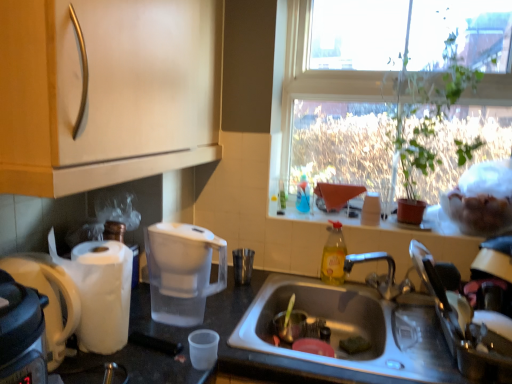
This screenshot has width=512, height=384. What do you see at coordinates (243, 265) in the screenshot?
I see `brushed metal cup at sink, the second coffee cup when ordered from front to back` at bounding box center [243, 265].

Locate an element on the screen. The image size is (512, 384). yellow translucent bottle at sink, which is counted as the 2th bottle, starting from the top is located at coordinates (334, 255).

The width and height of the screenshot is (512, 384). Describe the element at coordinates (334, 255) in the screenshot. I see `yellow translucent bottle at sink, which is counted as the 2th bottle, starting from the top` at that location.

Find the location of a particular element. This screenshot has height=384, width=512. white plastic coffee maker at left, marked as the 1th coffee maker in a front-to-back arrangement is located at coordinates (48, 298).

You are a GUI agent. You are given a task and a screenshot of the screen. Output one action in this format:
    pyautogui.click(x=<x>, y=<y>)
    Task: Click on the transparent plastic water filter at center, the first coffee maker when ordered from back to front
    This screenshot has height=384, width=512.
    Given the screenshot: What is the action you would take?
    pyautogui.click(x=182, y=271)

Which object is positioned more to the right, green leafy plant at upper right or stainless steel sink at lower center?

green leafy plant at upper right.

Is stainless steel sink at lower center a part of green leafy plant at upper right?

No, stainless steel sink at lower center is not surrounded by green leafy plant at upper right.

From a real-world perspective, does green leafy plant at upper right sit lower than stainless steel sink at lower center?

No, from a real-world perspective, green leafy plant at upper right is not under stainless steel sink at lower center.

Based on their sizes in the image, would you say translucent plastic spray bottle at upper right, the first bottle from the top, is bigger or smaller than white plastic coffee maker at left, marked as the 1th coffee maker in a front-to-back arrangement?

translucent plastic spray bottle at upper right, the first bottle from the top, is smaller than white plastic coffee maker at left, marked as the 1th coffee maker in a front-to-back arrangement.

Can you confirm if translucent plastic spray bottle at upper right, positioned as the 2th bottle in bottom-to-top order, is thinner than white plastic coffee maker at left, marked as the 1th coffee maker in a front-to-back arrangement?

Correct, the width of translucent plastic spray bottle at upper right, positioned as the 2th bottle in bottom-to-top order, is less than that of white plastic coffee maker at left, marked as the 1th coffee maker in a front-to-back arrangement.

From the image's perspective, does translucent plastic spray bottle at upper right, the first bottle from the top, appear higher than white plastic coffee maker at left, marked as the 1th coffee maker in a front-to-back arrangement?

Yes, from the image's perspective, translucent plastic spray bottle at upper right, the first bottle from the top, is over white plastic coffee maker at left, marked as the 1th coffee maker in a front-to-back arrangement.

Is white plastic coffee maker at left, marked as the 1th coffee maker in a front-to-back arrangement, completely or partially inside translucent plastic spray bottle at upper right, marked as the 2th bottle in a front-to-back arrangement?

That's incorrect, white plastic coffee maker at left, marked as the 1th coffee maker in a front-to-back arrangement, is not inside translucent plastic spray bottle at upper right, marked as the 2th bottle in a front-to-back arrangement.

From the image's perspective, which one is positioned lower, brushed metal cup at sink, which is the 2th coffee cup from bottom to top, or yellow translucent bottle at sink, positioned as the first bottle in right-to-left order?

From the image's view, brushed metal cup at sink, which is the 2th coffee cup from bottom to top, is below.

Is brushed metal cup at sink, the 1th coffee cup in the back-to-front sequence, with yellow translucent bottle at sink, positioned as the first bottle in right-to-left order?

There is a gap between brushed metal cup at sink, the 1th coffee cup in the back-to-front sequence, and yellow translucent bottle at sink, positioned as the first bottle in right-to-left order.

Does brushed metal cup at sink, marked as the first coffee cup in a right-to-left arrangement, contain yellow translucent bottle at sink, which is counted as the 2th bottle, starting from the top?

That's incorrect, yellow translucent bottle at sink, which is counted as the 2th bottle, starting from the top, is not inside brushed metal cup at sink, marked as the first coffee cup in a right-to-left arrangement.

Can you tell me how much brushed metal cup at sink, which is the 2th coffee cup from bottom to top, and yellow translucent bottle at sink, which is the first bottle in bottom-to-top order, differ in facing direction?

19.8 degrees.

From the image's perspective, which one is positioned lower, yellow translucent bottle at sink, which ranks as the first bottle in front-to-back order, or transparent plastic cup at lower center, the 1th coffee cup when ordered from left to right?

transparent plastic cup at lower center, the 1th coffee cup when ordered from left to right, from the image's perspective.

Which is in front, yellow translucent bottle at sink, arranged as the second bottle when viewed from the back, or transparent plastic cup at lower center, which is the 1th coffee cup from bottom to top?

transparent plastic cup at lower center, which is the 1th coffee cup from bottom to top.

Is point (331, 226) positioned before point (198, 335)?

That is False.

In the scene shown: Are white plastic coffee maker at left, which ranks as the 2th coffee maker in right-to-left order, and transparent glass window at upper right located far from each other?

That's right, there is a large distance between white plastic coffee maker at left, which ranks as the 2th coffee maker in right-to-left order, and transparent glass window at upper right.

Considering the relative sizes of white plastic coffee maker at left, marked as the 1th coffee maker in a front-to-back arrangement, and transparent glass window at upper right in the image provided, is white plastic coffee maker at left, marked as the 1th coffee maker in a front-to-back arrangement, thinner than transparent glass window at upper right?

In fact, white plastic coffee maker at left, marked as the 1th coffee maker in a front-to-back arrangement, might be wider than transparent glass window at upper right.

From the image's perspective, is white plastic coffee maker at left, which ranks as the 2th coffee maker in right-to-left order, located above or below transparent glass window at upper right?

Clearly, from the image's perspective, white plastic coffee maker at left, which ranks as the 2th coffee maker in right-to-left order, is below transparent glass window at upper right.

Is point (62, 323) closer or farther from the camera than point (293, 42)?

Clearly, point (62, 323) is closer to the camera than point (293, 42).

From the picture: Between translucent plastic spray bottle at upper right, positioned as the 2th bottle in bottom-to-top order, and transparent glass window at upper right, which one is positioned in front?

transparent glass window at upper right is more forward.

How much distance is there between translucent plastic spray bottle at upper right, which appears as the first bottle when viewed from the left, and transparent glass window at upper right?

translucent plastic spray bottle at upper right, which appears as the first bottle when viewed from the left, is 13.41 inches from transparent glass window at upper right.

Is translucent plastic spray bottle at upper right, the first bottle from the top, situated inside transparent glass window at upper right or outside?

translucent plastic spray bottle at upper right, the first bottle from the top, is inside transparent glass window at upper right.

From the picture: Which point is more forward, (x=306, y=199) or (x=306, y=37)?

Point (x=306, y=199)

Is point (446, 84) farther from camera compared to point (250, 256)?

No.

Is green leafy plant at upper right looking in the opposite direction of brushed metal cup at sink, which is the 2th coffee cup from bottom to top?

No, green leafy plant at upper right's orientation is not away from brushed metal cup at sink, which is the 2th coffee cup from bottom to top.

Is green leafy plant at upper right spatially inside brushed metal cup at sink, the 1th coffee cup in the back-to-front sequence, or outside of it?

green leafy plant at upper right is not inside brushed metal cup at sink, the 1th coffee cup in the back-to-front sequence, it's outside.

Who is smaller, green leafy plant at upper right or brushed metal cup at sink, marked as the second coffee cup in a left-to-right arrangement?

Smaller between the two is brushed metal cup at sink, marked as the second coffee cup in a left-to-right arrangement.

The width and height of the screenshot is (512, 384). Find the location of `sink to the left of green leafy plant at upper right`. sink to the left of green leafy plant at upper right is located at coordinates pyautogui.click(x=349, y=334).

The image size is (512, 384). Identify the location of coffee maker that is the 2nd object located in front of the translucent plastic spray bottle at upper right, which appears as the first bottle when viewed from the left. (48, 298).

Considering their positions, is clear glass bottle at upper center positioned further to stainless steel sink at lower center than matte wood cabinet at upper left?

matte wood cabinet at upper left lies further to stainless steel sink at lower center than the other object.

Looking at the image, which one is located closer to clear glass bottle at upper center, transparent plastic water filter at center, marked as the second coffee maker in a front-to-back arrangement, or green leafy plant at upper right?

Among the two, green leafy plant at upper right is located nearer to clear glass bottle at upper center.

When comparing their distances from green leafy plant at upper right, does white plastic coffee maker at left, marked as the 1th coffee maker in a front-to-back arrangement, or yellow translucent bottle at sink, which is the first bottle in bottom-to-top order, seem closer?

The object closer to green leafy plant at upper right is yellow translucent bottle at sink, which is the first bottle in bottom-to-top order.

From the picture: From the image, which object appears to be farther from transparent glass window at upper right, yellow translucent bottle at sink, the 2th bottle in the left-to-right sequence, or white plastic coffee maker at left, the first coffee maker when ordered from left to right?

white plastic coffee maker at left, the first coffee maker when ordered from left to right, is further to transparent glass window at upper right.

Considering their positions, is green leafy plant at upper right positioned closer to brushed metal cup at sink, the second coffee cup when ordered from front to back, than transparent glass window at upper right?

The object closer to brushed metal cup at sink, the second coffee cup when ordered from front to back, is transparent glass window at upper right.

Which object lies nearer to the anchor point matte wood cabinet at upper left, brushed metal cup at sink, the first coffee cup viewed from the top, or transparent plastic water filter at center, the first coffee maker when ordered from back to front?

transparent plastic water filter at center, the first coffee maker when ordered from back to front.

Considering their positions, is stainless steel sink at lower center positioned closer to transparent glass window at upper right than transparent plastic water filter at center, the first coffee maker when ordered from back to front?

stainless steel sink at lower center is closer to transparent glass window at upper right.

Looking at the image, which one is located further to transparent glass window at upper right, transparent plastic cup at lower center, which is the 1th coffee cup from front to back, or matte wood cabinet at upper left?

Based on the image, transparent plastic cup at lower center, which is the 1th coffee cup from front to back, appears to be further to transparent glass window at upper right.

Where is `bottle between transparent glass window at upper right and clear glass bottle at upper center from top to bottom`? This screenshot has width=512, height=384. bottle between transparent glass window at upper right and clear glass bottle at upper center from top to bottom is located at coordinates (303, 196).

Identify the location of window sill between transparent plastic water filter at center, the first coffee maker when ordered from back to front, and transparent glass window at upper right. Image resolution: width=512 pixels, height=384 pixels. (317, 211).

Image resolution: width=512 pixels, height=384 pixels. Find the location of `sink between matte wood cabinet at upper left and transparent glass window at upper right from left to right`. sink between matte wood cabinet at upper left and transparent glass window at upper right from left to right is located at coordinates (349, 334).

Image resolution: width=512 pixels, height=384 pixels. Identify the location of coffee maker between white plastic coffee maker at left, marked as the 1th coffee maker in a front-to-back arrangement, and transparent plastic cup at lower center, which is the 1th coffee cup from front to back, from left to right. [182, 271].